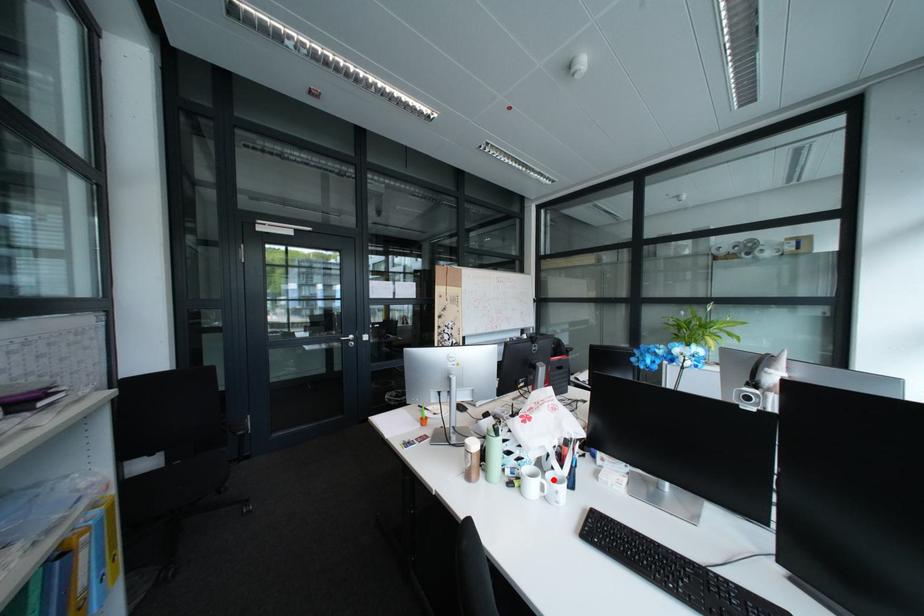
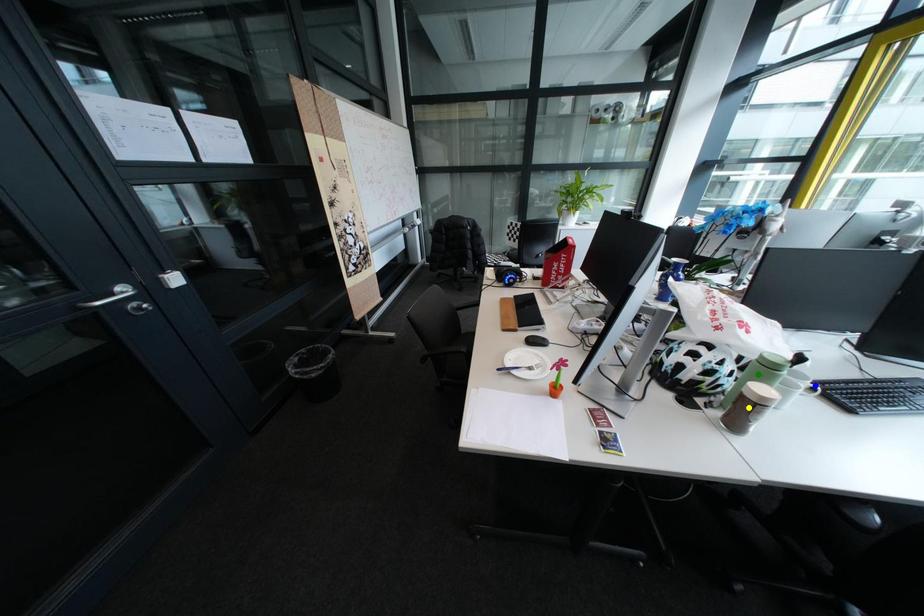
Question: I am providing you with two images of the same scene from different viewpoints. A red point is marked on the first image. You are given multiple points on the second image. Which spot in image 2 lines up with the point in image 1?

Choices:
 (A) yellow point
 (B) green point
 (C) blue point

Answer: (C)